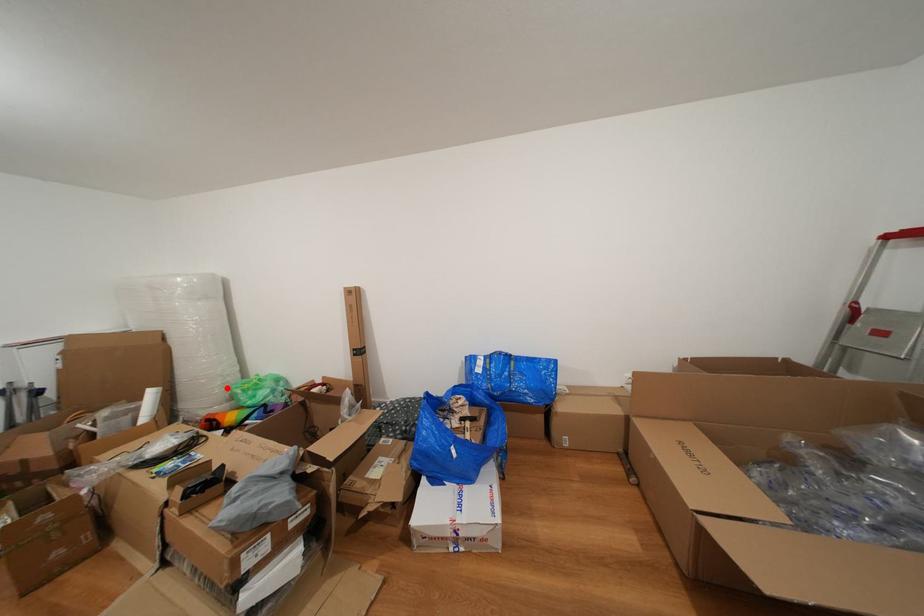
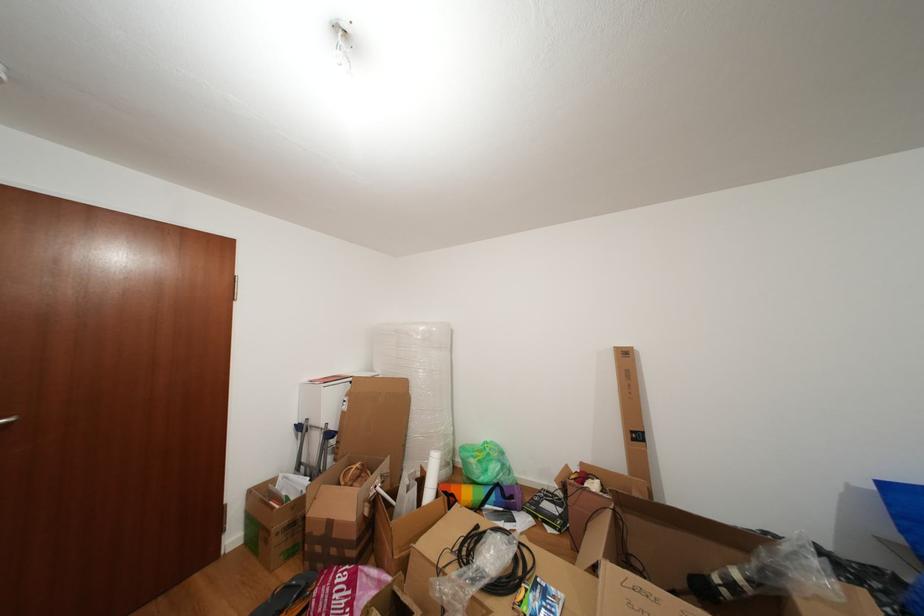
Question: I am providing you with two images of the same scene from different viewpoints. In image1, a red point is highlighted. Considering the same 3D point in image2, which of the following is correct?

Choices:
 (A) It is closer
 (B) It is farther

Answer: (B)